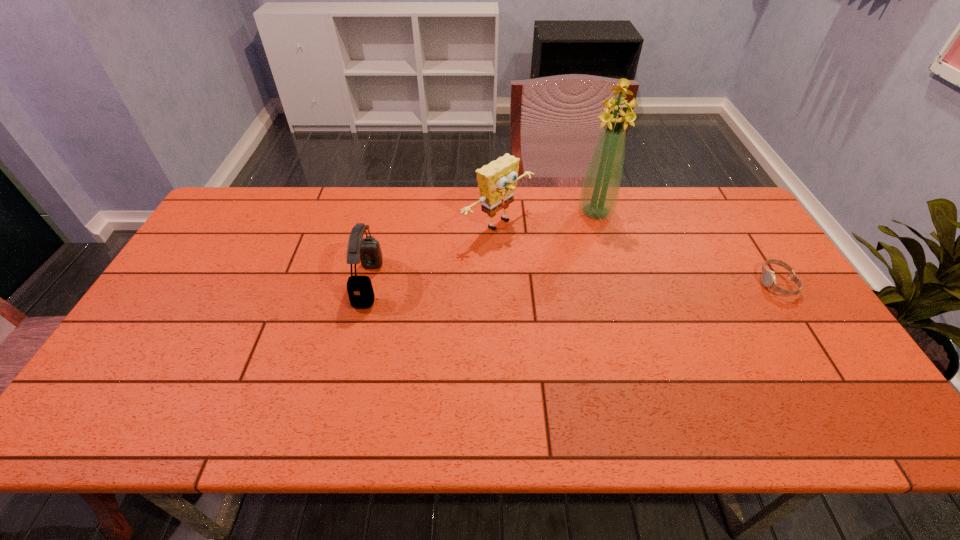
Identify the location of free point located on the face of the shortest object. (702, 283).

This screenshot has height=540, width=960. Identify the location of free space located 0.170m on the face of the shortest object. (702, 283).

Image resolution: width=960 pixels, height=540 pixels. I want to click on free spot located on the face of the shortest object, so click(x=730, y=283).

Image resolution: width=960 pixels, height=540 pixels. I want to click on vacant space situated 0.340m on the front-facing side of the third object from left to right, so click(x=566, y=293).

Where is `blank space located on the front-facing side of the third object from left to right`? blank space located on the front-facing side of the third object from left to right is located at coordinates (566, 293).

The image size is (960, 540). Identify the location of vacant region located on the front-facing side of the third object from left to right. (582, 251).

This screenshot has height=540, width=960. Identify the location of vacant space situated on the face of the sponge. (591, 282).

At what (x,y) coordinates should I click in order to perform the action: click on blank area located 0.170m on the face of the sponge. Please return your answer as a coordinate pair (x, y). Looking at the image, I should click on (568, 268).

The image size is (960, 540). Find the location of `free location located on the face of the sponge`. free location located on the face of the sponge is located at coordinates (583, 276).

Locate an element on the screen. bouquet present at the far edge is located at coordinates (600, 189).